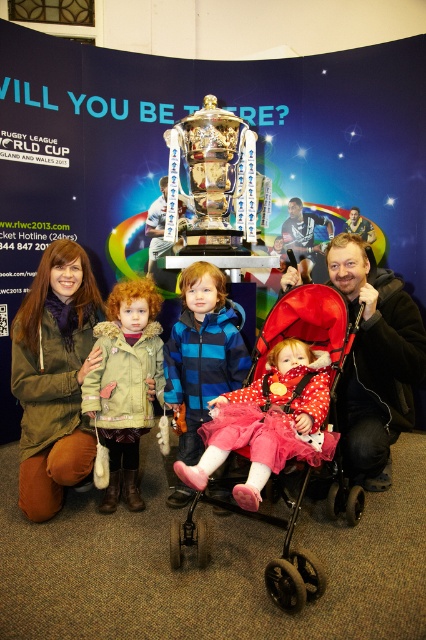
You are a photographer setting up for a family photo shoot in front of the Rugby League World Cup 2013 backdrop. You need to ensure that both the red fabric baby carriage at center and the blue fleece jacket at center are visible in the frame. Given their sizes, which object should you prioritize positioning closer to the camera to ensure it doesn not get lost in the background?

The blue fleece jacket at center is smaller in size compared to the red fabric baby carriage at center. To ensure visibility, prioritize positioning the blue fleece jacket at center closer to the camera.

Consider the image. In the family photo taken in front of the Rugby League World Cup 2013 backdrop, the two adults are wearing a matte olive green jacket at center and a polka dot fabric dress at center. Which adult is positioned to the left of the other?

The matte olive green jacket at center is to the left of the polka dot fabric dress at center.